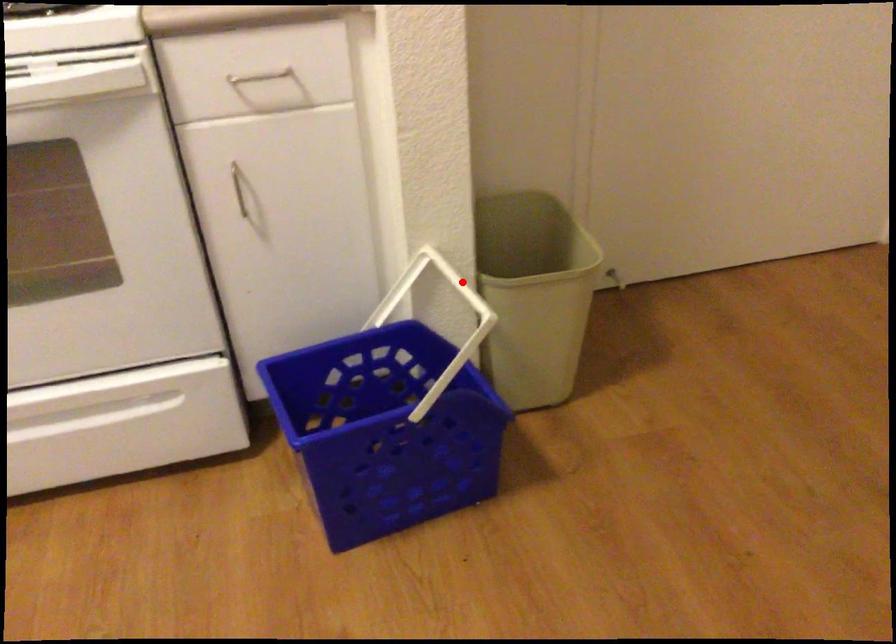
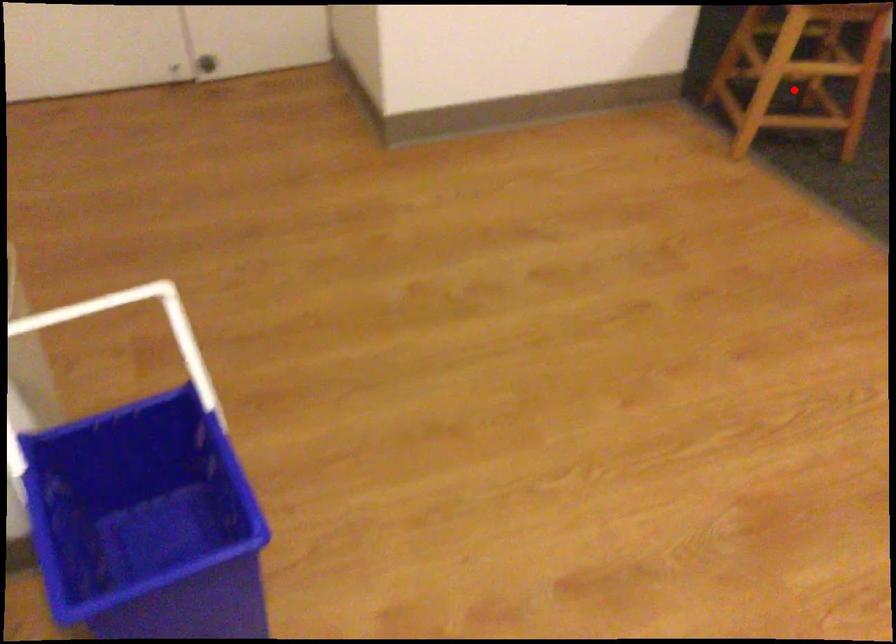
I am providing you with two images of the same scene from different viewpoints. A red point is marked on the first image and another point is marked on the second image. Is the marked point in image1 the same physical position as the marked point in image2?

No